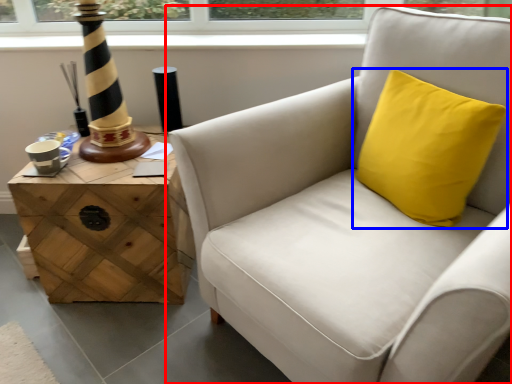
Question: Among these objects, which one is farthest to the camera, chair (highlighted by a red box) or pillow (highlighted by a blue box)?

Choices:
 (A) chair
 (B) pillow

Answer: (B)